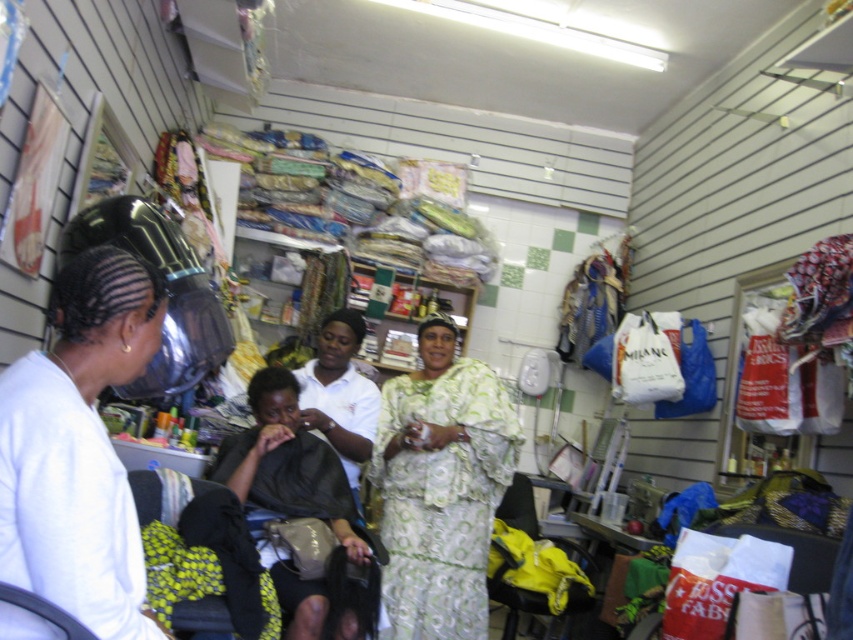
Is green floral fabric dress at center bigger than white fabric at center?

Yes.

Who is higher up, green floral fabric dress at center or white fabric at center?

white fabric at center

This screenshot has width=853, height=640. What do you see at coordinates (442, 499) in the screenshot?
I see `green floral fabric dress at center` at bounding box center [442, 499].

Where is `green floral fabric dress at center`? green floral fabric dress at center is located at coordinates (442, 499).

Which is above, green floral fabric dress at center or black fabric at center?

black fabric at center

Does green floral fabric dress at center have a greater width compared to black fabric at center?

Incorrect, green floral fabric dress at center's width does not surpass black fabric at center's.

Who is more forward, (453, 461) or (318, 477)?

Point (318, 477)

Find the location of `green floral fabric dress at center`. green floral fabric dress at center is located at coordinates (442, 499).

Is white matte hair at left further to camera compared to green floral fabric dress at center?

No, it is in front of green floral fabric dress at center.

In the scene shown: Can you confirm if white matte hair at left is positioned below green floral fabric dress at center?

Actually, white matte hair at left is above green floral fabric dress at center.

Who is more forward, (x=79, y=564) or (x=393, y=552)?

Positioned in front is point (x=79, y=564).

You are a GUI agent. You are given a task and a screenshot of the screen. Output one action in this format:
    pyautogui.click(x=<x>, y=<y>)
    Task: Click on the white matte hair at left
    
    Given the screenshot: What is the action you would take?
    pyautogui.click(x=78, y=449)